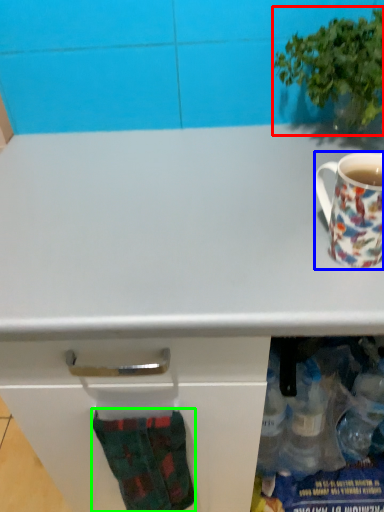
Question: Which object is the closest to the houseplant (highlighted by a red box)? Choose among these: coffee cup (highlighted by a blue box) or sock (highlighted by a green box).

Choices:
 (A) coffee cup
 (B) sock

Answer: (A)